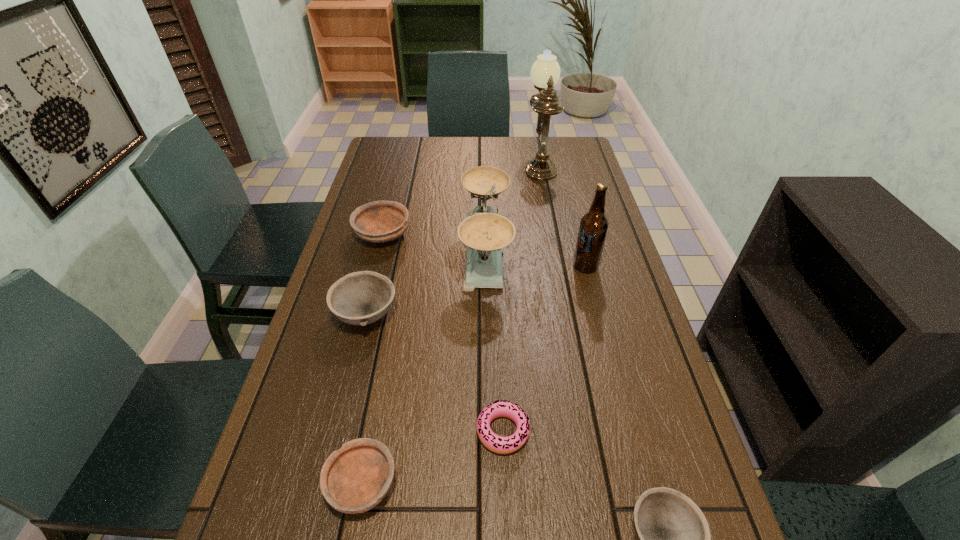
At what (x,y) coordinates should I click in order to perform the action: click on the closest bowl to the shortest bowl. Please return your answer as a coordinate pair (x, y). This screenshot has width=960, height=540. Looking at the image, I should click on (360, 298).